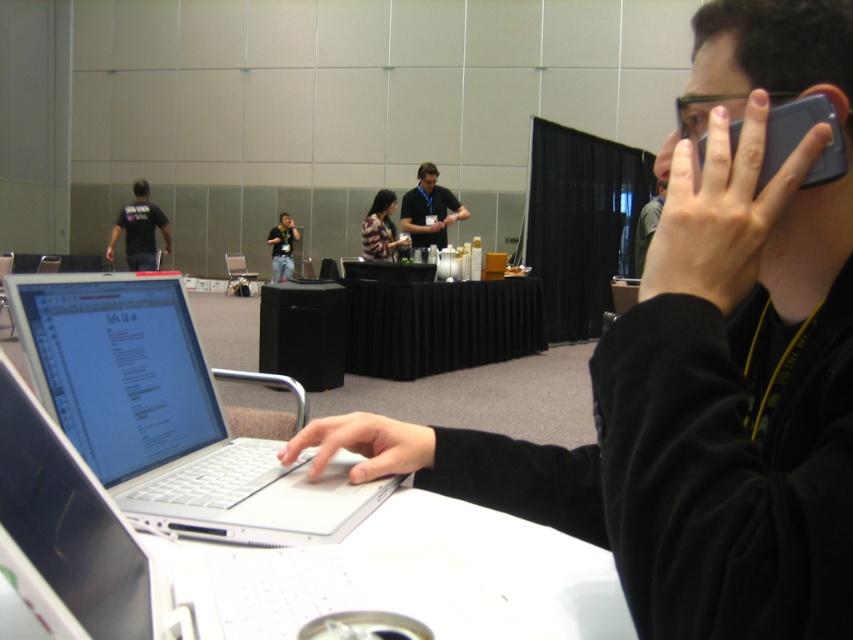
Question: Can you confirm if black fabric table at center is positioned above black matte smartphone at upper right?

Choices:
 (A) no
 (B) yes

Answer: (A)

Question: Which of these objects is positioned farthest from the matte black shirt at upper right?

Choices:
 (A) black shirt at center
 (B) denim jeans at center

Answer: (B)

Question: Which object is positioned farthest from the black shirt at center?

Choices:
 (A) striped fabric shirt at center
 (B) white plastic laptop at center

Answer: (B)

Question: Where is white plastic laptop at center located in relation to denim jeans at center in the image?

Choices:
 (A) above
 (B) below

Answer: (B)

Question: Is black fabric table at center wider than matte black shirt at upper right?

Choices:
 (A) yes
 (B) no

Answer: (A)

Question: Which object is closer to the camera taking this photo?

Choices:
 (A) denim jeans at center
 (B) black fabric shirt at upper left

Answer: (B)